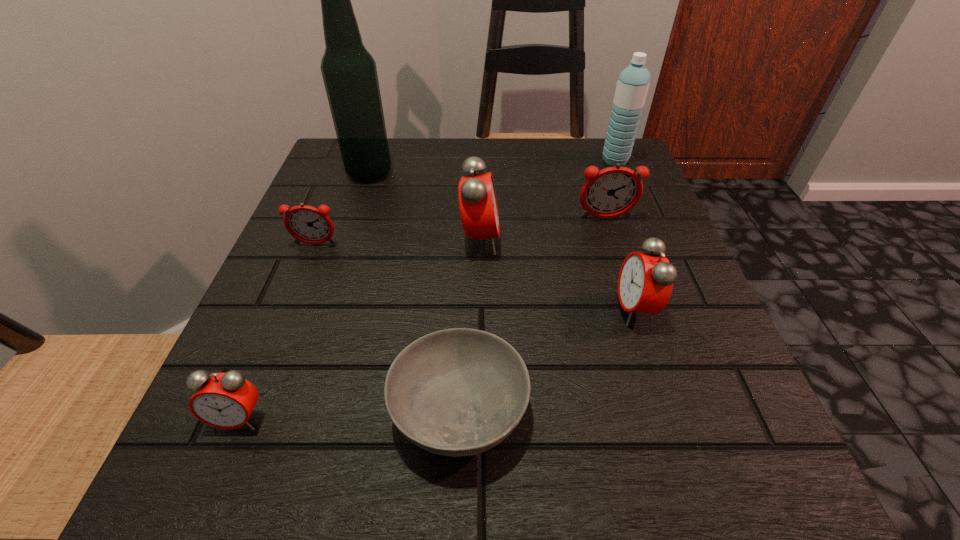
The height and width of the screenshot is (540, 960). Find the location of `object situated at the far right corner`. object situated at the far right corner is located at coordinates (632, 86).

Image resolution: width=960 pixels, height=540 pixels. In the image, there is a desktop. Identify the location of vacant space at the far edge. (486, 145).

Identify the location of free space at the near edge of the desktop. (334, 456).

This screenshot has width=960, height=540. In order to click on free space at the left edge of the desktop in this screenshot , I will do `click(300, 327)`.

This screenshot has width=960, height=540. What are the coordinates of `free space at the right edge of the desktop` in the screenshot? It's located at click(747, 392).

Locate an element on the screen. Image resolution: width=960 pixels, height=540 pixels. blank space at the far left corner of the desktop is located at coordinates (349, 183).

At what (x,y) coordinates should I click in order to perform the action: click on free location at the near left corner. Please return your answer as a coordinate pair (x, y). Image resolution: width=960 pixels, height=540 pixels. Looking at the image, I should click on (204, 475).

Where is `vacant area at the far right corner`? The width and height of the screenshot is (960, 540). vacant area at the far right corner is located at coordinates (576, 195).

Identify the location of vacant space at the near right corner of the desktop. (745, 487).

Identify the location of vacant area between the shortest object and the tallest object. (415, 291).